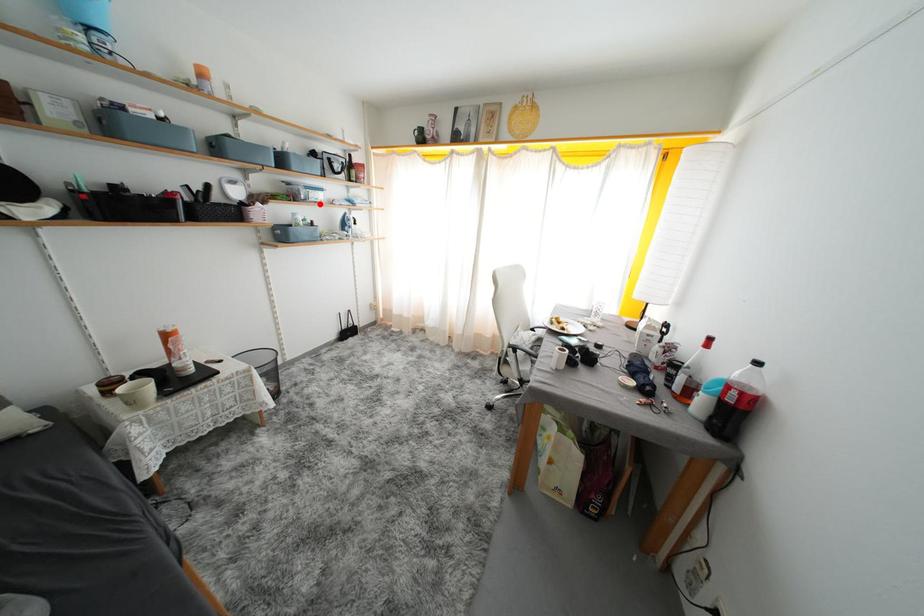
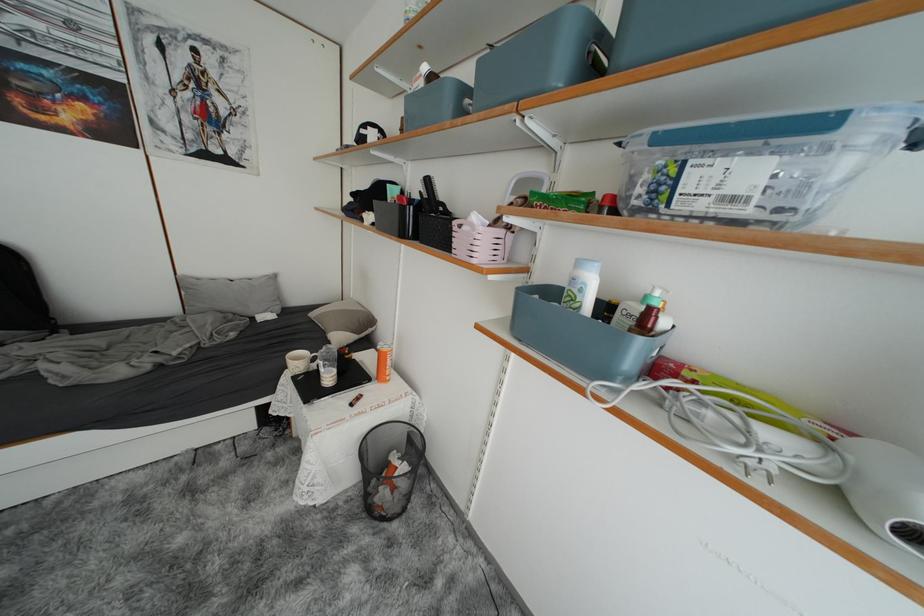
In the second image, find the point that corresponds to the highlighted location in the first image.

(709, 209)